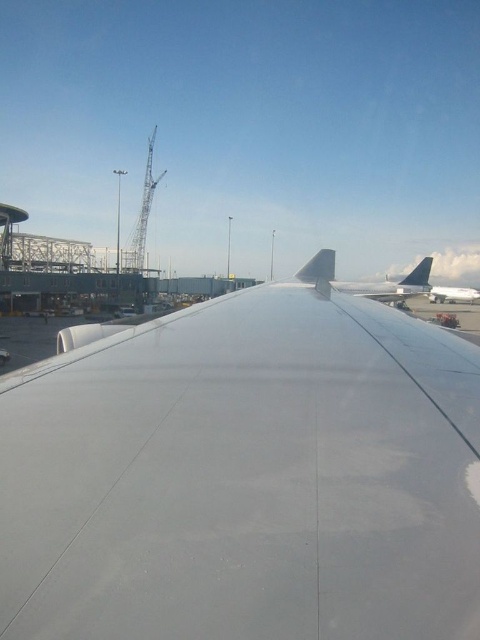
You are a passenger sitting in the aircraft and looking out the window. You see the white matte wing at center and the polished aluminum tail at upper right. Which object is nearer to you?

The white matte wing at center is closer to the viewer than the polished aluminum tail at upper right.

You are a pilot preparing for takeoff and notice a point at coordinates (319,268) on your aircraft window. What object is located at this point?

The matte white tail at center is located at point (319,268).

You are a passenger seated in the aircraft and want to touch the white matte wing at center. Considering your arm length is 22 inches, can you reach it?

The white matte wing at center is 24.87 inches away from viewer, so no, you cannot reach it with an arm length of 22 inches.